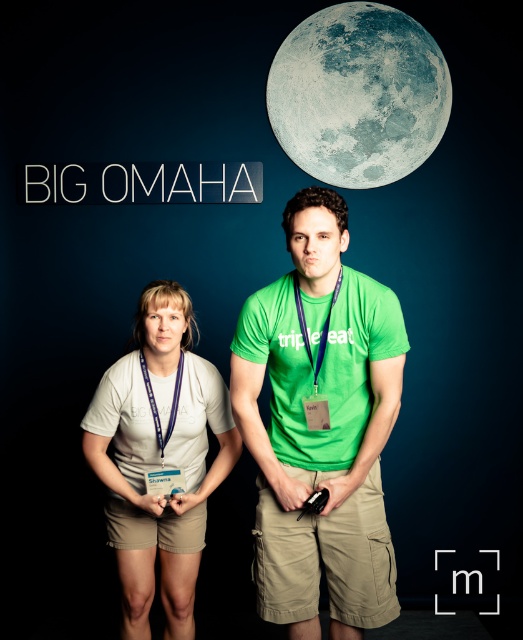
Which is above, white cotton t-shirt at center or gray textured moon at upper center?

Positioned higher is gray textured moon at upper center.

Who is lower down, white cotton t-shirt at center or gray textured moon at upper center?

white cotton t-shirt at center

Between point (194, 384) and point (414, 90), which one is positioned behind?

Positioned behind is point (414, 90).

This screenshot has width=523, height=640. In order to click on white cotton t-shirt at center in this screenshot , I will do `click(158, 458)`.

Who is positioned more to the left, green matte shirt at center or gray textured moon at upper center?

green matte shirt at center is more to the left.

The width and height of the screenshot is (523, 640). Describe the element at coordinates (321, 429) in the screenshot. I see `green matte shirt at center` at that location.

The height and width of the screenshot is (640, 523). Find the location of `green matte shirt at center`. green matte shirt at center is located at coordinates (321, 429).

Does green matte shirt at center have a greater width compared to white cotton t-shirt at center?

In fact, green matte shirt at center might be narrower than white cotton t-shirt at center.

Is green matte shirt at center shorter than white cotton t-shirt at center?

No, green matte shirt at center is not shorter than white cotton t-shirt at center.

Does point (379, 465) lie behind point (197, 481)?

No, it is not.

Where is `green matte shirt at center`? The image size is (523, 640). green matte shirt at center is located at coordinates (321, 429).